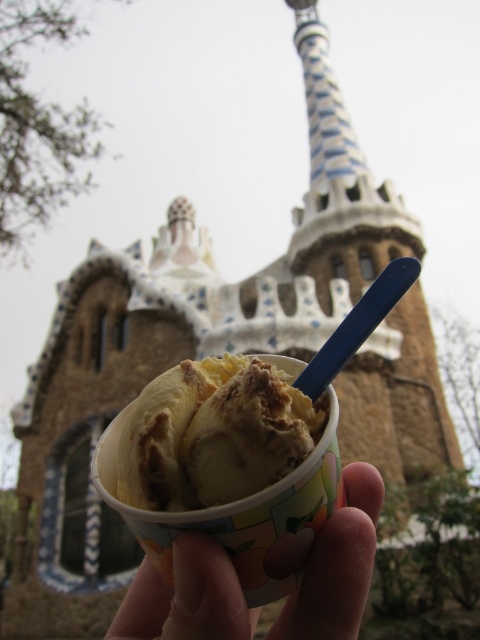
You are holding a cup of ice cream and want to make sure your hand can fully cover the top of the ice cream. Based on the scene, can your smooth skin hand at center completely cover the vanilla ice cream at center?

The vanilla ice cream at center has a width that is less than the smooth skin hand at center, so yes, the smooth skin hand at center can completely cover the vanilla ice cream at center.

You are holding a cup of ice cream with two points marked on it. The first point is at coordinates point [193,500] and the second is at point [206,580]. From your perspective, which point is closer to you?

Point [206,580] is closer to you because point [193,500] is behind it.